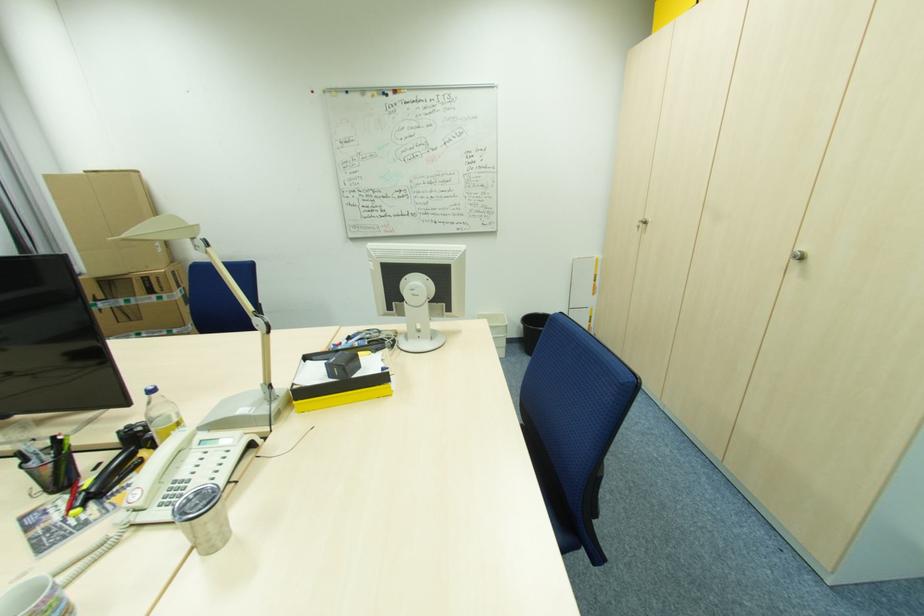
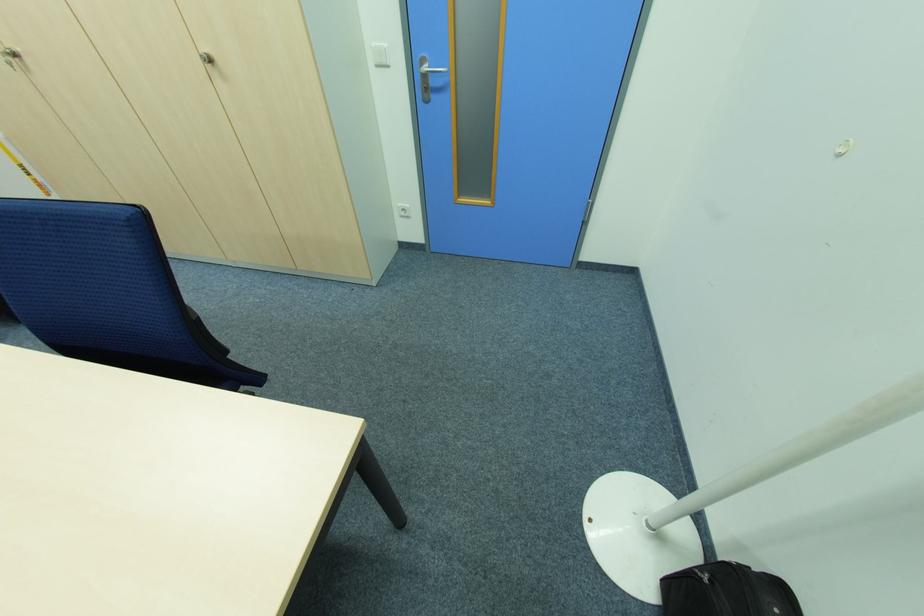
The point at [641,227] is marked in the first image. Where is the corresponding point in the second image?

(14, 65)